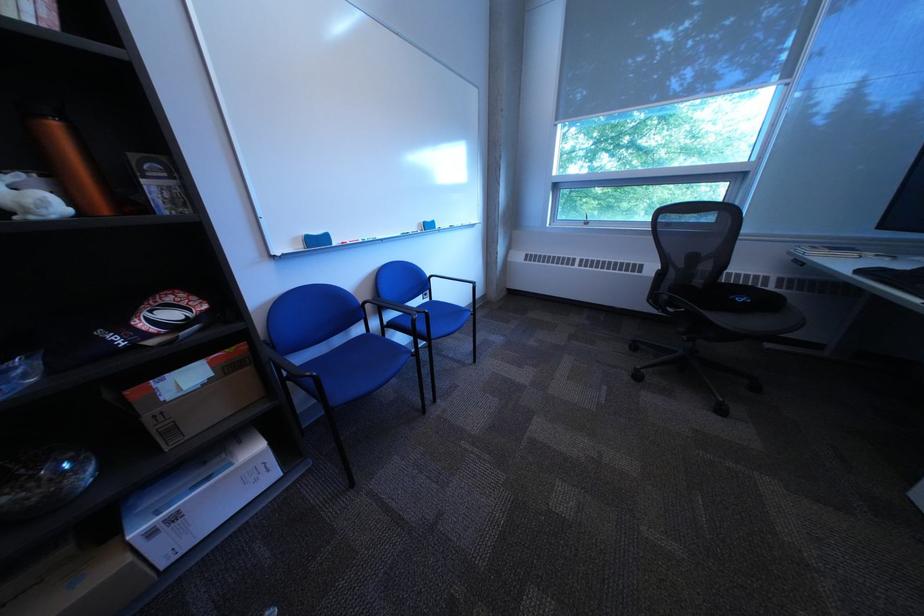
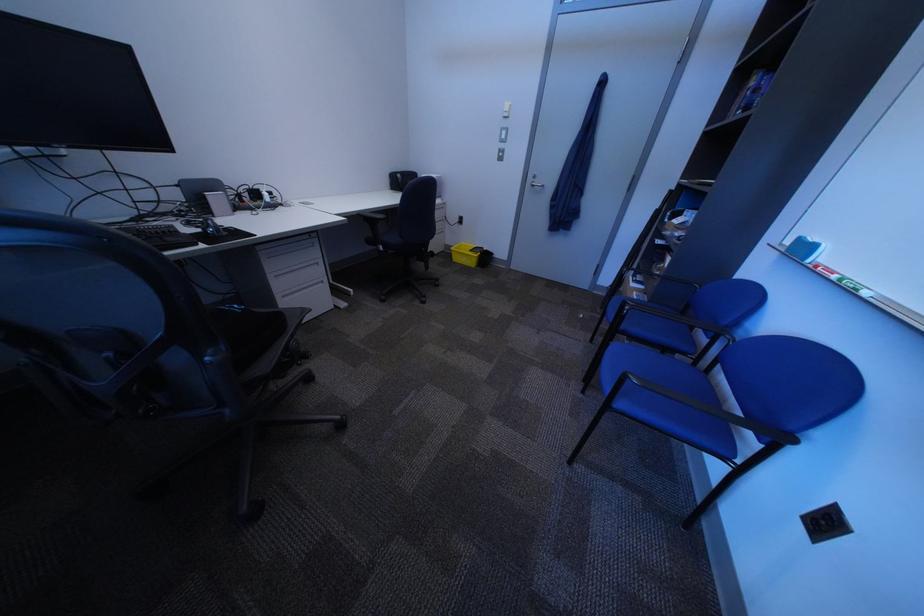
In the second image, find the point that corresponds to [377,243] in the first image.

(849, 278)